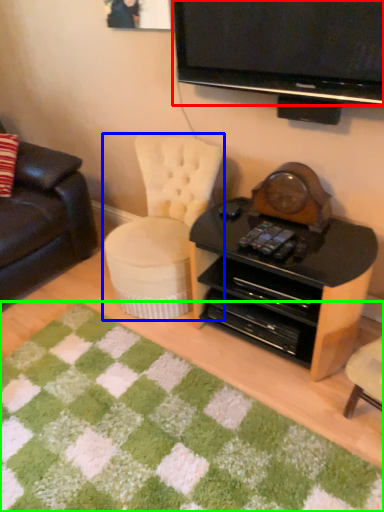
Question: Estimate the real-world distances between objects in this image. Which object is closer to television (highlighted by a red box), chair (highlighted by a blue box) or mat (highlighted by a green box)?

Choices:
 (A) chair
 (B) mat

Answer: (A)